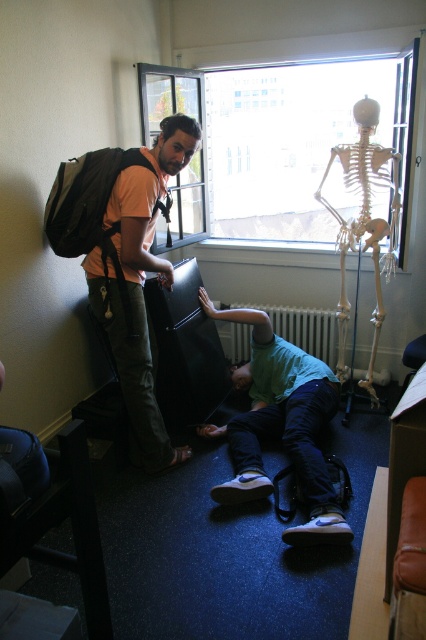
Does point (270, 433) come in front of point (290, 337)?

Yes, it is in front of point (290, 337).

Which is more to the right, green matte shirt at lower center or white metallic radiator at center?

Positioned to the right is white metallic radiator at center.

This screenshot has height=640, width=426. Describe the element at coordinates (281, 426) in the screenshot. I see `green matte shirt at lower center` at that location.

Where is `green matte shirt at lower center`? green matte shirt at lower center is located at coordinates (281, 426).

Does point (198, 168) come farther from viewer compared to point (135, 289)?

Yes, point (198, 168) is farther from viewer.

Which is above, transparent glass window at upper center or matte orange t-shirt at upper left?

transparent glass window at upper center is higher up.

Is point (307, 198) more distant than point (187, 160)?

Yes, point (307, 198) is behind point (187, 160).

Find the location of a particular element. This screenshot has height=640, width=426. transparent glass window at upper center is located at coordinates (285, 145).

From the picture: Which is more to the left, green matte shirt at lower center or matte orange t-shirt at upper left?

From the viewer's perspective, matte orange t-shirt at upper left appears more on the left side.

Based on the photo, does green matte shirt at lower center have a smaller size compared to matte orange t-shirt at upper left?

Incorrect, green matte shirt at lower center is not smaller in size than matte orange t-shirt at upper left.

Between point (342, 516) and point (163, 269), which one is positioned behind?

The point (163, 269) is more distant.

Identify the location of green matte shirt at lower center. The height and width of the screenshot is (640, 426). (281, 426).